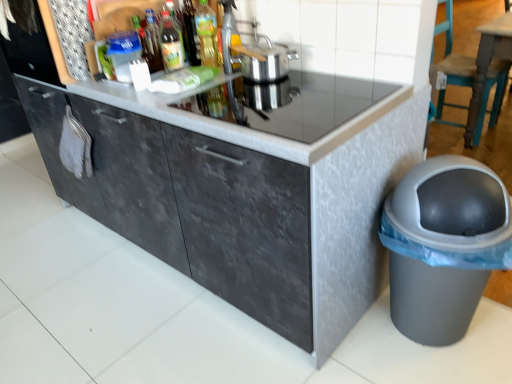
This screenshot has width=512, height=384. I want to click on blank space above black glass countertop at center (from a real-world perspective), so click(261, 97).